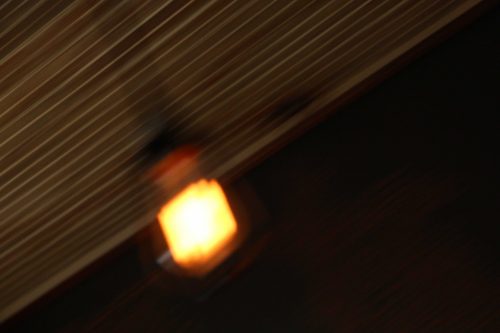
Find the location of a particular element. The height and width of the screenshot is (333, 500). glow from light is located at coordinates (144, 266), (254, 212), (168, 159).